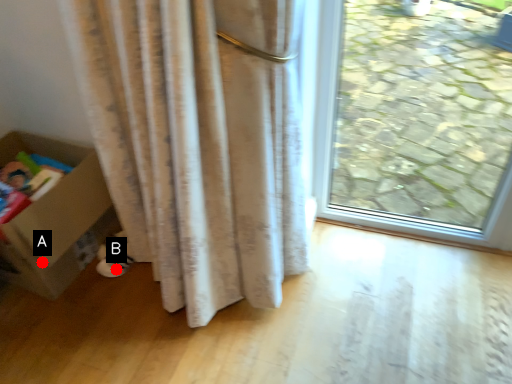
Question: Two points are circled on the image, labeled by A and B beside each circle. Which of the following is the closest to the observer?

Choices:
 (A) A is closer
 (B) B is closer

Answer: (A)